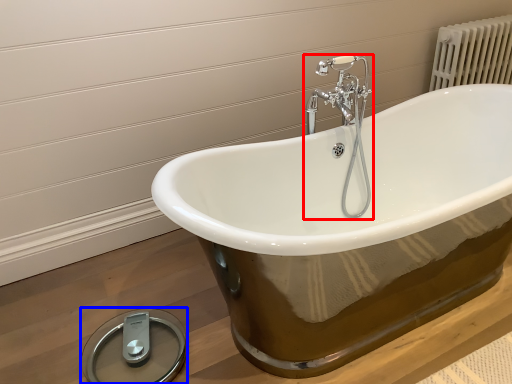
Question: Among these objects, which one is farthest to the camera, tap (highlighted by a red box) or scale (highlighted by a blue box)?

Choices:
 (A) tap
 (B) scale

Answer: (A)